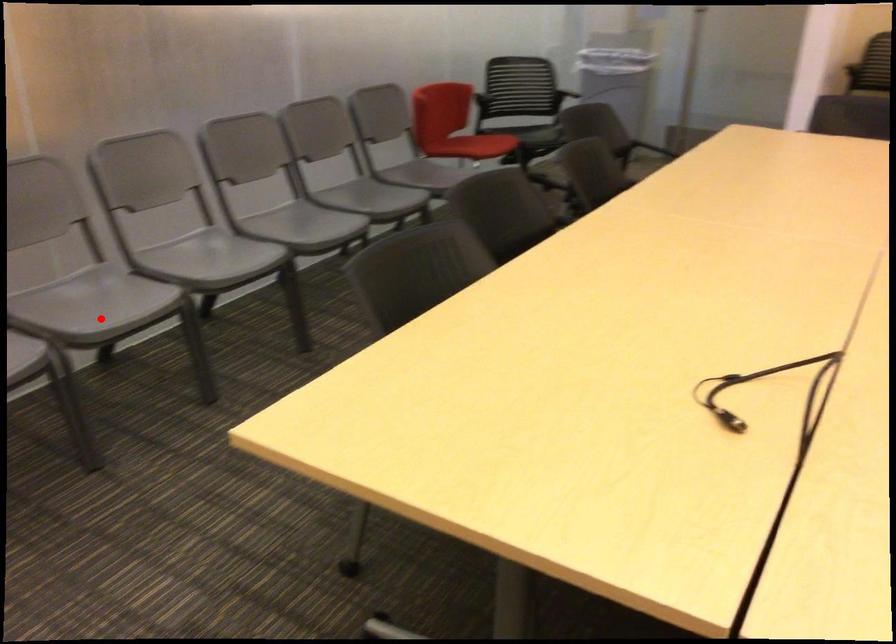
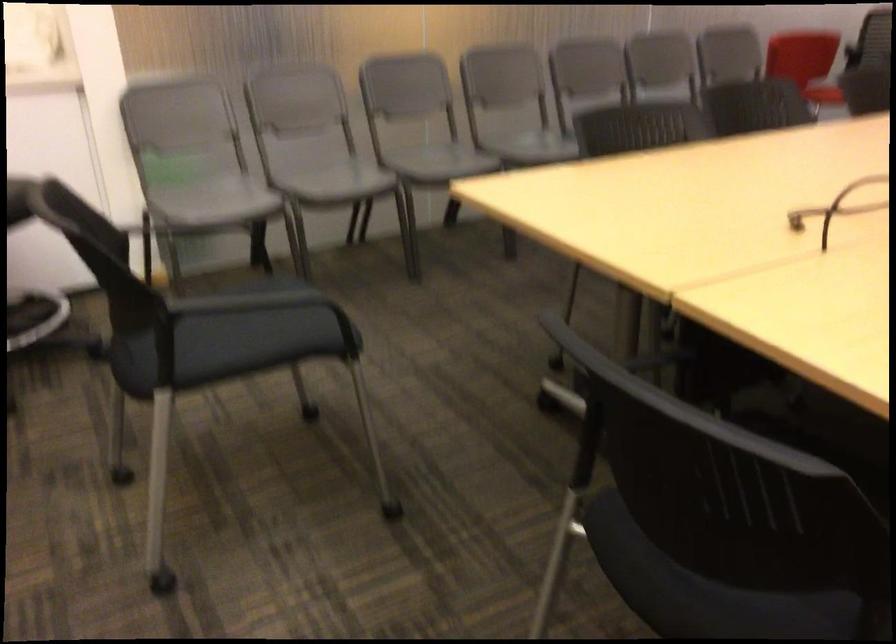
The point at the highlighted location is marked in the first image. Where is the corresponding point in the second image?

(436, 161)